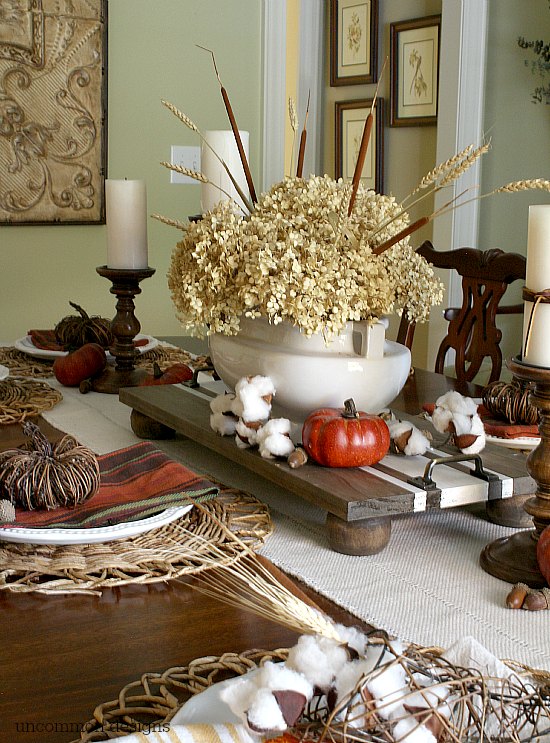
In order to click on two wooden candlesticks in this screenshot , I will do `click(541, 464)`, `click(126, 316)`.